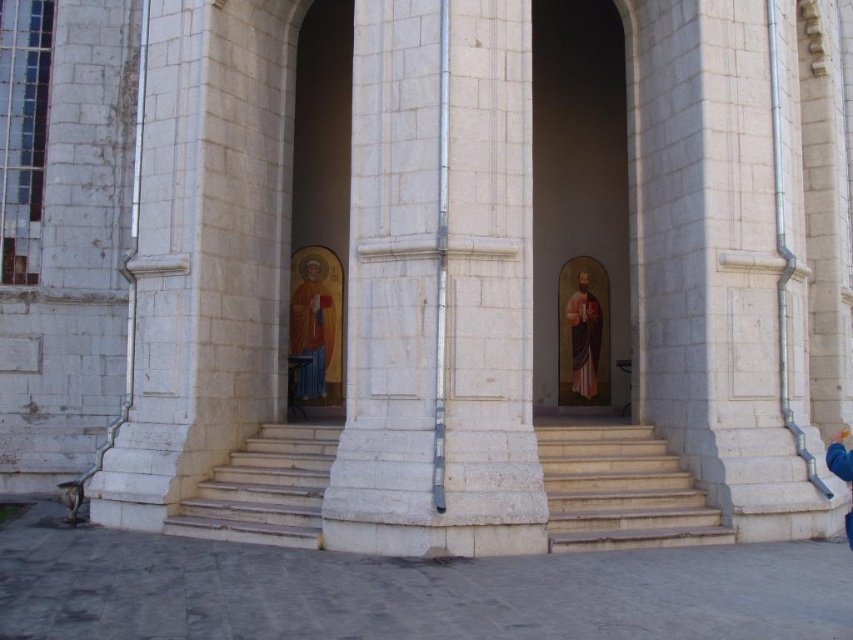
Can you confirm if matte gold icon at left is shorter than light brown stone stairs at center?

Incorrect, matte gold icon at left's height does not fall short of light brown stone stairs at center's.

Is matte gold icon at left bigger than light brown stone stairs at center?

Indeed, matte gold icon at left has a larger size compared to light brown stone stairs at center.

Describe the element at coordinates (320, 202) in the screenshot. This screenshot has width=853, height=640. I see `matte gold icon at left` at that location.

The height and width of the screenshot is (640, 853). Find the location of `matte gold icon at left`. matte gold icon at left is located at coordinates (320, 202).

Can you confirm if matte gold icon at left is positioned to the right of golden textured icon at center?

Incorrect, matte gold icon at left is not on the right side of golden textured icon at center.

Which is behind, point (294, 324) or point (595, 321)?

The point (595, 321) is behind.

Identify the location of matte gold icon at left. (320, 202).

Between point (318, 173) and point (312, 301), which one is positioned behind?

Positioned behind is point (318, 173).

Find the location of a particular element. Image resolution: width=853 pixels, height=640 pixels. matte gold icon at left is located at coordinates (320, 202).